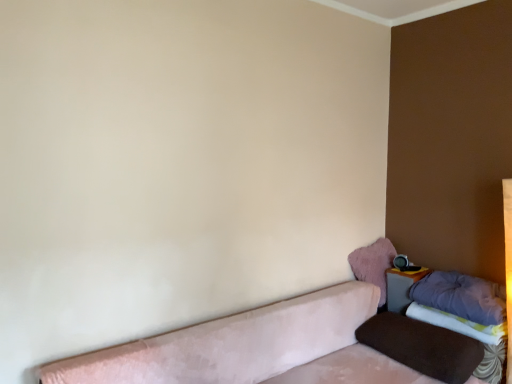
Where is `purple fabric sheet at lower right`? This screenshot has height=384, width=512. purple fabric sheet at lower right is located at coordinates (457, 323).

Describe the element at coordinates (457, 323) in the screenshot. I see `purple fabric sheet at lower right` at that location.

What do you see at coordinates (401, 287) in the screenshot? I see `matte gray table at lower right` at bounding box center [401, 287].

Locate an element on the screen. The height and width of the screenshot is (384, 512). brown velvety pillow at lower right, arranged as the 1th pillow when ordered from the bottom is located at coordinates (422, 346).

Are velvet pink couch at lower left and purple soft pillow at right, arranged as the second pillow when viewed from the top, beside each other?

No, velvet pink couch at lower left is not beside purple soft pillow at right, arranged as the second pillow when viewed from the top.

Consider the image. In the image, is velvet pink couch at lower left on the left side or the right side of purple soft pillow at right, the second pillow from the bottom?

In the image, velvet pink couch at lower left appears on the left side of purple soft pillow at right, the second pillow from the bottom.

Find the location of a particular element. The height and width of the screenshot is (384, 512). studio couch in front of the purple soft pillow at right, the second pillow from the bottom is located at coordinates (261, 342).

Which of these two, velvet pink couch at lower left or purple soft pillow at right, arranged as the second pillow when viewed from the top, stands taller?

velvet pink couch at lower left.

Is purple fabric sheet at lower right inside matte gray table at lower right?

No, purple fabric sheet at lower right is not surrounded by matte gray table at lower right.

In terms of width, does matte gray table at lower right look wider or thinner when compared to purple fabric sheet at lower right?

Clearly, matte gray table at lower right has less width compared to purple fabric sheet at lower right.

Does point (401, 310) come closer to viewer compared to point (423, 305)?

No, (401, 310) is further to viewer.

Consider the image. Which of these two, matte gray table at lower right or purple fabric sheet at lower right, stands shorter?

Standing shorter between the two is purple fabric sheet at lower right.

How many degrees apart are the facing directions of purple fabric sheet at lower right and purple soft pillow at right, arranged as the second pillow when viewed from the top?

They differ by 8.41e-06 degrees in their facing directions.

Is purple fabric sheet at lower right directly adjacent to purple soft pillow at right, arranged as the second pillow when viewed from the top?

Absolutely, purple fabric sheet at lower right is next to and touching purple soft pillow at right, arranged as the second pillow when viewed from the top.

Looking at this image, which of these two, purple fabric sheet at lower right or purple soft pillow at right, arranged as the second pillow when viewed from the top, is thinner?

purple fabric sheet at lower right.

Which object is closer to the camera taking this photo, purple fabric sheet at lower right or purple soft pillow at right, the second pillow from the bottom?

purple soft pillow at right, the second pillow from the bottom, is more forward.

In the scene shown: Which of these two, brown velvety pillow at lower right, which is the 3th pillow in top-to-bottom order, or purple fabric sheet at lower right, stands taller?

brown velvety pillow at lower right, which is the 3th pillow in top-to-bottom order, is taller.

What's the angular difference between brown velvety pillow at lower right, which is the 3th pillow in top-to-bottom order, and purple fabric sheet at lower right's facing directions?

90.3 degrees separate the facing orientations of brown velvety pillow at lower right, which is the 3th pillow in top-to-bottom order, and purple fabric sheet at lower right.

Between brown velvety pillow at lower right, which is the 3th pillow in top-to-bottom order, and purple fabric sheet at lower right, which one has smaller width?

Thinner between the two is purple fabric sheet at lower right.

From a real-world perspective, which object stands above the other?

purple fabric sheet at lower right, from a real-world perspective.

Is fuzzy pink pillow at upper right, positioned as the 3th pillow in bottom-to-top order, shorter than purple soft pillow at right, arranged as the second pillow when viewed from the top?

In fact, fuzzy pink pillow at upper right, positioned as the 3th pillow in bottom-to-top order, may be taller than purple soft pillow at right, arranged as the second pillow when viewed from the top.

From the image's perspective, which is below, fuzzy pink pillow at upper right, which is counted as the 1th pillow, starting from the top, or purple soft pillow at right, arranged as the second pillow when viewed from the top?

From the image's view, purple soft pillow at right, arranged as the second pillow when viewed from the top, is below.

Relative to purple soft pillow at right, arranged as the second pillow when viewed from the top, is fuzzy pink pillow at upper right, which is counted as the 1th pillow, starting from the top, in front or behind?

fuzzy pink pillow at upper right, which is counted as the 1th pillow, starting from the top, is behind purple soft pillow at right, arranged as the second pillow when viewed from the top.

Is fuzzy pink pillow at upper right, which is counted as the 1th pillow, starting from the top, positioned beyond the bounds of purple soft pillow at right, the second pillow from the bottom?

fuzzy pink pillow at upper right, which is counted as the 1th pillow, starting from the top, lies outside purple soft pillow at right, the second pillow from the bottom,'s area.

From a real-world perspective, is purple fabric sheet at lower right located beneath velvet pink couch at lower left?

Incorrect, from a real-world perspective, purple fabric sheet at lower right is higher than velvet pink couch at lower left.

Between purple fabric sheet at lower right and velvet pink couch at lower left, which one is positioned behind?

purple fabric sheet at lower right.

How different are the orientations of purple fabric sheet at lower right and velvet pink couch at lower left in degrees?

90.3 degrees separate the facing orientations of purple fabric sheet at lower right and velvet pink couch at lower left.

Measure the distance from purple fabric sheet at lower right to velvet pink couch at lower left.

They are 24.87 inches apart.

From the image's perspective, relative to brown velvety pillow at lower right, which is the 3th pillow in top-to-bottom order, is purple fabric sheet at lower right above or below?

Based on their image positions, purple fabric sheet at lower right is located above brown velvety pillow at lower right, which is the 3th pillow in top-to-bottom order.

Between purple fabric sheet at lower right and brown velvety pillow at lower right, arranged as the 1th pillow when ordered from the bottom, which one is positioned behind?

purple fabric sheet at lower right is further from the camera.

I want to click on sheet on the right of brown velvety pillow at lower right, arranged as the 1th pillow when ordered from the bottom, so click(457, 323).

How distant is purple fabric sheet at lower right from brown velvety pillow at lower right, which is the 3th pillow in top-to-bottom order?

purple fabric sheet at lower right and brown velvety pillow at lower right, which is the 3th pillow in top-to-bottom order, are 7.90 inches apart.

Where is `the 2nd pillow above the velvet pink couch at lower left (from a real-world perspective)`? the 2nd pillow above the velvet pink couch at lower left (from a real-world perspective) is located at coordinates (459, 297).

This screenshot has height=384, width=512. What are the coordinates of `sheet in front of the matte gray table at lower right` in the screenshot? It's located at [457, 323].

Based on their spatial positions, is purple fabric sheet at lower right or fuzzy pink pillow at upper right, positioned as the 3th pillow in bottom-to-top order, further from matte gray table at lower right?

purple fabric sheet at lower right.

In the scene shown: Which object lies further to the anchor point velvet pink couch at lower left, matte gray table at lower right or brown velvety pillow at lower right, which is the 3th pillow in top-to-bottom order?

The object further to velvet pink couch at lower left is matte gray table at lower right.

When comparing their distances from brown velvety pillow at lower right, arranged as the 1th pillow when ordered from the bottom, does velvet pink couch at lower left or matte gray table at lower right seem further?

matte gray table at lower right.

Considering their positions, is brown velvety pillow at lower right, arranged as the 1th pillow when ordered from the bottom, positioned further to velvet pink couch at lower left than matte gray table at lower right?

Among the two, matte gray table at lower right is located further to velvet pink couch at lower left.

Based on their spatial positions, is fuzzy pink pillow at upper right, which is counted as the 1th pillow, starting from the top, or velvet pink couch at lower left closer to matte gray table at lower right?

fuzzy pink pillow at upper right, which is counted as the 1th pillow, starting from the top, lies closer to matte gray table at lower right than the other object.

Which object lies nearer to the anchor point brown velvety pillow at lower right, arranged as the 1th pillow when ordered from the bottom, velvet pink couch at lower left or purple soft pillow at right, arranged as the second pillow when viewed from the top?

Based on the image, purple soft pillow at right, arranged as the second pillow when viewed from the top, appears to be nearer to brown velvety pillow at lower right, arranged as the 1th pillow when ordered from the bottom.

Considering their positions, is purple soft pillow at right, arranged as the second pillow when viewed from the top, positioned further to velvet pink couch at lower left than fuzzy pink pillow at upper right, positioned as the 3th pillow in bottom-to-top order?

purple soft pillow at right, arranged as the second pillow when viewed from the top, is positioned further to the anchor velvet pink couch at lower left.

Considering their positions, is purple soft pillow at right, arranged as the second pillow when viewed from the top, positioned closer to purple fabric sheet at lower right than brown velvety pillow at lower right, arranged as the 1th pillow when ordered from the bottom?

purple soft pillow at right, arranged as the second pillow when viewed from the top, is positioned closer to the anchor purple fabric sheet at lower right.

The height and width of the screenshot is (384, 512). What are the coordinates of `pillow positioned between velvet pink couch at lower left and purple soft pillow at right, arranged as the second pillow when viewed from the top, from near to far` in the screenshot? It's located at (422, 346).

The image size is (512, 384). I want to click on table positioned between purple soft pillow at right, the second pillow from the bottom, and fuzzy pink pillow at upper right, which is counted as the 1th pillow, starting from the top, from near to far, so click(x=401, y=287).

In order to click on table between purple fabric sheet at lower right and fuzzy pink pillow at upper right, which is counted as the 1th pillow, starting from the top, from front to back in this screenshot , I will do `click(401, 287)`.

At what (x,y) coordinates should I click in order to perform the action: click on sheet located between brown velvety pillow at lower right, which is the 3th pillow in top-to-bottom order, and matte gray table at lower right in the depth direction. Please return your answer as a coordinate pair (x, y). Image resolution: width=512 pixels, height=384 pixels. Looking at the image, I should click on (457, 323).